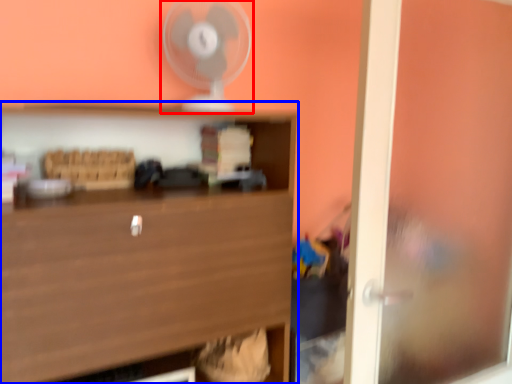
Question: Which of the following is the farthest to the observer, fan (highlighted by a red box) or shelf (highlighted by a blue box)?

Choices:
 (A) fan
 (B) shelf

Answer: (A)